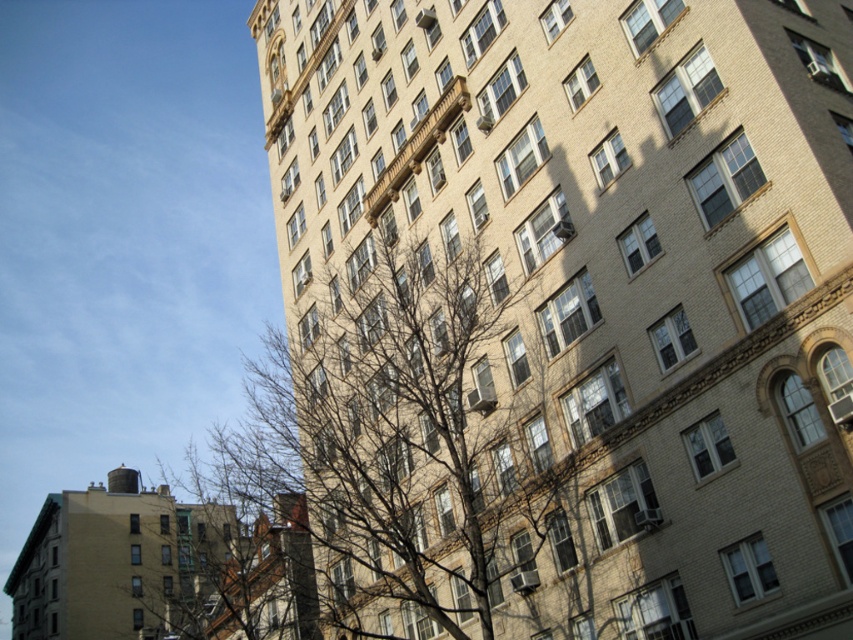
You are a painter standing in front of the beige brick building at center and the bare branches at left. You want to paint the entire scene. Which object should you paint first if you follow the standard painting technique of starting with the background before moving to the foreground?

You should paint the beige brick building at center first because it is positioned over the bare branches at left, meaning it is in the background and should be painted before the foreground elements.

You are standing in front of the beige brick building at center. There is a point marked at coordinates [602,280]. Where is this point located?

The point at [602,280] is on the beige brick building at center.

You are an architect analyzing the image of a building and a tree. Based on the scene, can the beige brick building at center fit entirely within the space occupied by the bare branches at left in terms of width?

The beige brick building at center is narrower than the bare branches at left, so it can fit entirely within the space occupied by the bare branches at left in terms of width.